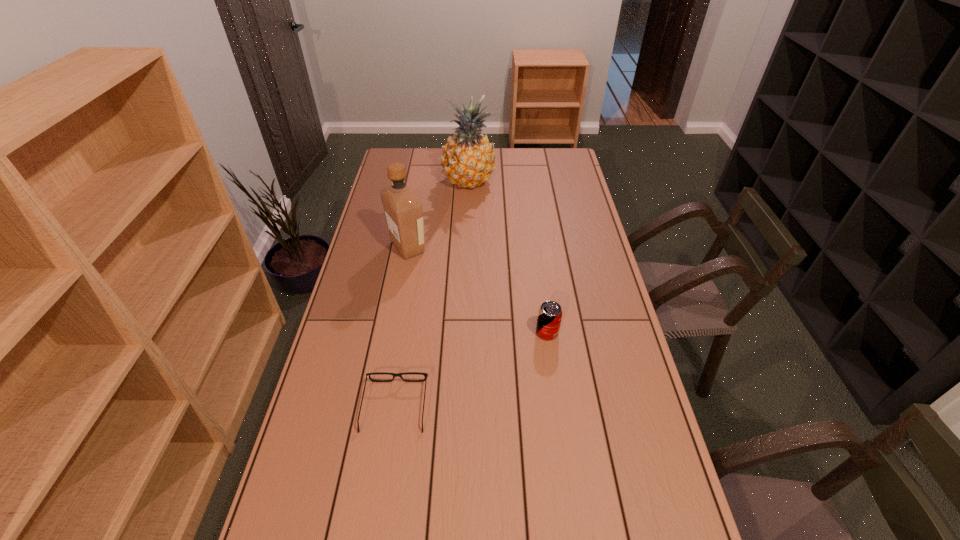
Locate an element on the screen. Image resolution: width=960 pixels, height=540 pixels. vacant space in between the second farthest object and the spectacles is located at coordinates (401, 327).

Locate an element on the screen. free point between the shortest object and the soda can is located at coordinates (471, 369).

The width and height of the screenshot is (960, 540). I want to click on vacant space that's between the second farthest object and the pineapple, so click(438, 214).

This screenshot has height=540, width=960. Identify the location of blank region between the pineapple and the liquor. (438, 214).

Locate an element on the screen. free space between the third farthest object and the liquor is located at coordinates (477, 290).

Locate an element on the screen. Image resolution: width=960 pixels, height=540 pixels. free space between the shortest object and the third nearest object is located at coordinates (401, 327).

In order to click on empty space that is in between the nearest object and the rightmost object in this screenshot , I will do `click(471, 369)`.

At what (x,y) coordinates should I click in order to perform the action: click on unoccupied position between the pineapple and the nearest object. Please return your answer as a coordinate pair (x, y). The image size is (960, 540). Looking at the image, I should click on (432, 294).

The image size is (960, 540). What are the coordinates of `object that is the second closest to the nearest object` in the screenshot? It's located at (403, 211).

Locate an element on the screen. This screenshot has width=960, height=540. object that is the second closest to the spectacles is located at coordinates (403, 211).